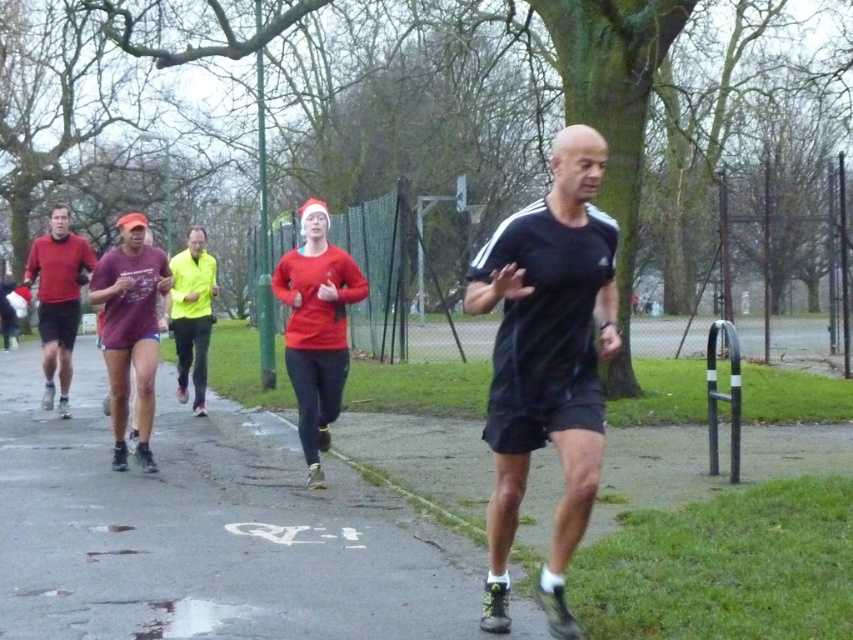
You are a runner preparing to step onto the smooth asphalt path at center. You see the black matte running shoe at center already on the path. Is the path below the shoe, making it safe to step on?

Yes, the smooth asphalt path at center is located below the black matte running shoe at center, so it is safe to step onto the path.

You are a delivery person who needs to deliver a package to the end of the asphalt path. You see the smooth asphalt path at center and the neon yellow jacket at center. Which object is wider?

The smooth asphalt path at center is wider than the neon yellow jacket at center according to the description.

You are a photographer trying to capture a photo of the red matte sweater at center and the neon yellow jacket at center. Since the scene is quite crowded, you want to ensure both are fully visible in your shot. Which clothing item should you focus on first to frame them properly?

The red matte sweater at center is not as tall as the neon yellow jacket at center, so you should focus on framing the neon yellow jacket at center first to ensure it fits within the frame before adjusting for the shorter red matte sweater at center.